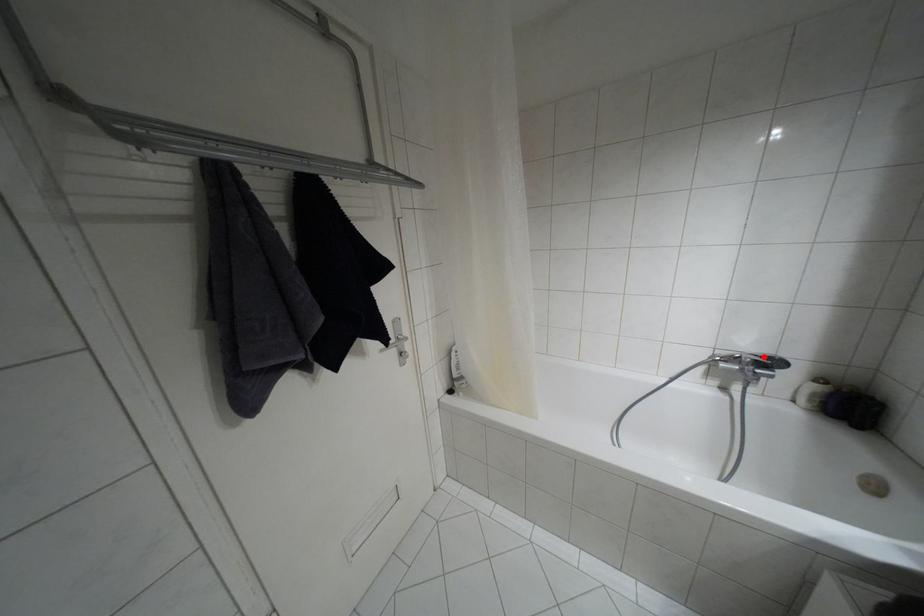
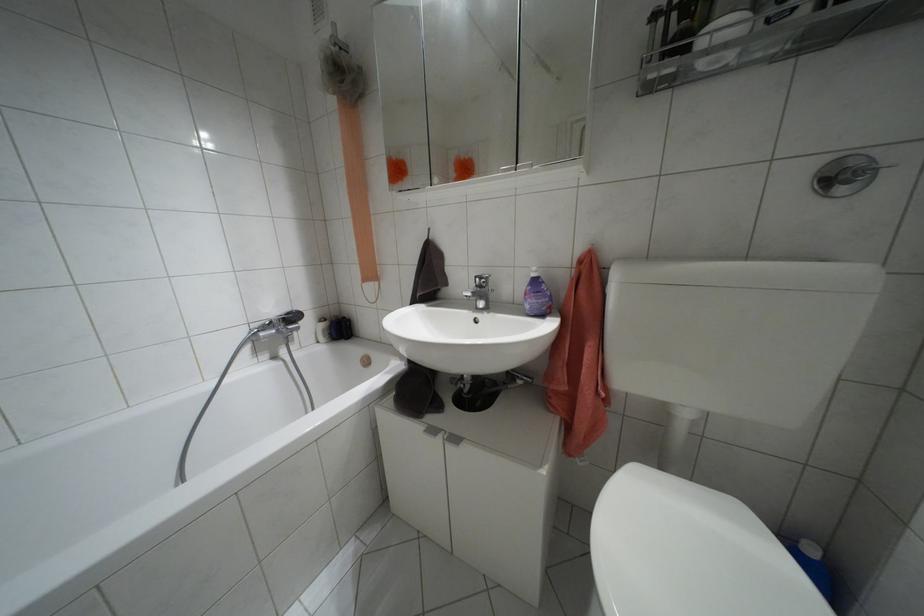
Question: I am providing you with two images of the same scene from different viewpoints. Image1 has a red point marked. In image2, the corresponding 3D location appears at what relative position? Reply with the corresponding letter.

Choices:
 (A) Closer
 (B) Farther

Answer: (A)